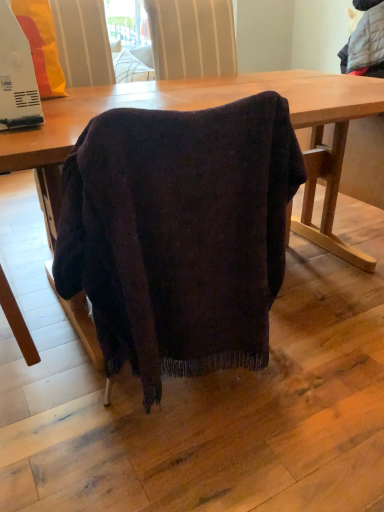
The width and height of the screenshot is (384, 512). I want to click on unoccupied region to the right of dark wood table at center, so click(323, 360).